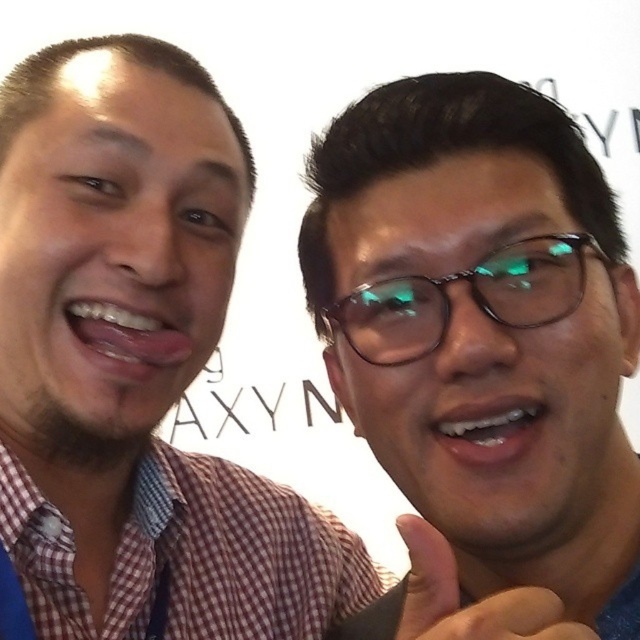
You are trying to take a photo of two people with their glasses. You see the matte black glasses at upper right and the green reflective glasses at center. Which glasses are located to the left of the other?

The matte black glasses at upper right is positioned on the left side of green reflective glasses at center.

You are taking a photo of two people standing side by side. You notice the checkered shirt at left and the matte black glasses at upper right. Which object appears taller in the photo?

The checkered shirt at left is taller than the matte black glasses at upper right.

You are taking a photo and want to ensure that both the matte black glasses at upper right and the green reflective glasses at center are clearly visible. Which glasses should you adjust the focus on first?

The matte black glasses at upper right is in front of the green reflective glasses at center, so you should adjust the focus on the matte black glasses at upper right first to ensure both are in focus.